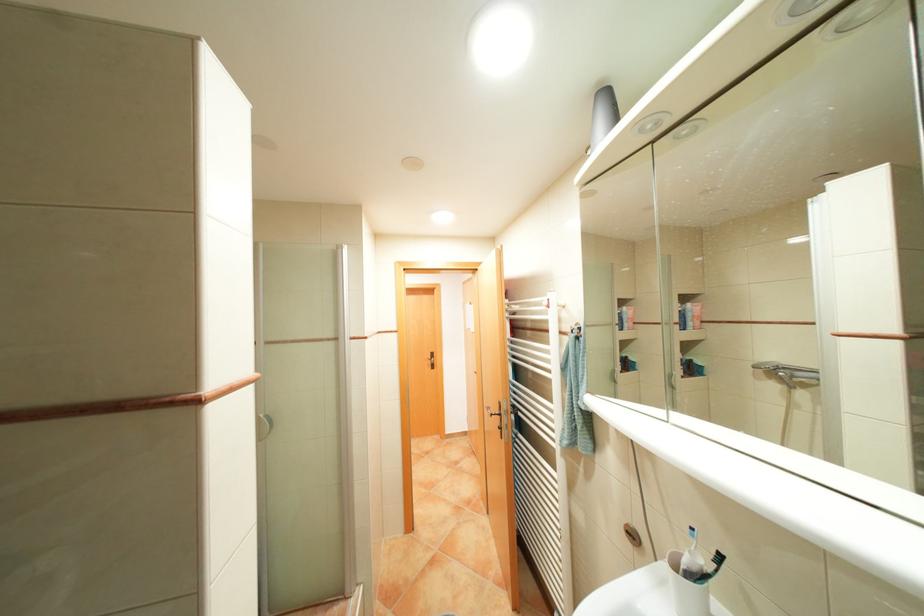
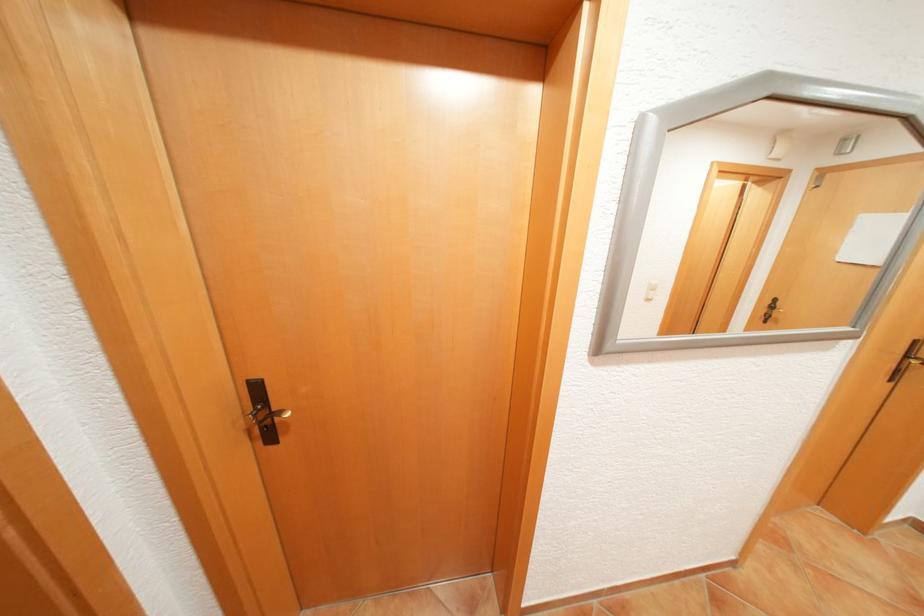
What movement of the cameraman would produce the second image?

The cameraman moved toward left, forward.